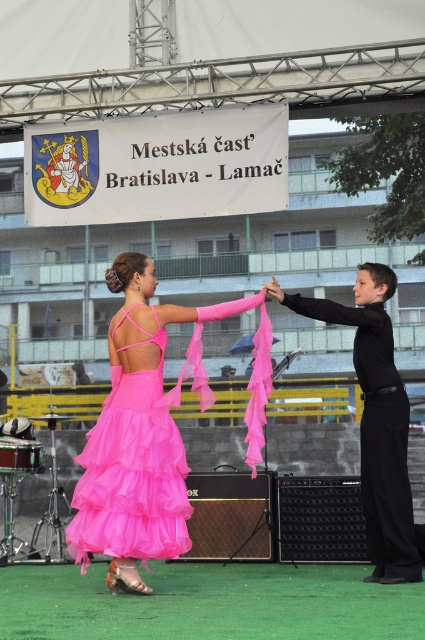
You are a photographer at the event and want to capture a photo of both the matte pink tulle dress at center and the black smooth pants at right. Based on their positions, which object should you focus on first if you are moving from left to right across the stage?

The matte pink tulle dress at center is positioned on the left side of black smooth pants at right, so you should focus on the matte pink tulle dress at center first as you move from left to right.

You are a photographer setting up for a dance performance. You need to position your camera so that both the matte pink tulle dress at center and the black smooth pants at right are in frame. Given their heights, which object should you adjust your focus to ensure both are clearly visible?

The matte pink tulle dress at center is taller than the black smooth pants at right. To ensure both are clearly visible, focus on the matte pink tulle dress at center since it is taller and requires attention to its upper details while the black smooth pants at right, being shorter, will naturally be within the camera frame.